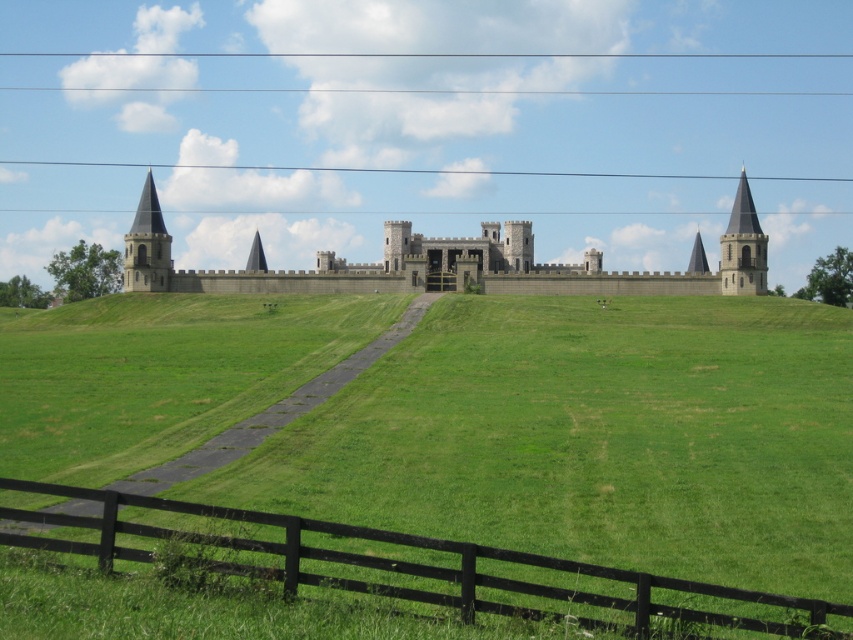
Question: Which point appears closest to the camera in this image?

Choices:
 (A) (390, 573)
 (B) (724, 268)
 (C) (709, 493)
 (D) (398, 268)

Answer: (A)

Question: Is black wooden fence at lower center to the left of smooth gray stone tower at right from the viewer's perspective?

Choices:
 (A) no
 (B) yes

Answer: (B)

Question: Which is nearer to the smooth stone tower at left?

Choices:
 (A) gray concrete castle at center
 (B) smooth gray stone tower at right
 (C) green grass at center
 (D) black wooden fence at lower center

Answer: (A)

Question: Can you confirm if green grass at center is bigger than smooth gray stone tower at right?

Choices:
 (A) no
 (B) yes

Answer: (B)

Question: Which of the following is the closest to the observer?

Choices:
 (A) (149, 241)
 (B) (144, 220)

Answer: (A)

Question: Considering the relative positions of green grass at center and black wooden fence at lower center in the image provided, where is green grass at center located with respect to black wooden fence at lower center?

Choices:
 (A) right
 (B) left

Answer: (B)